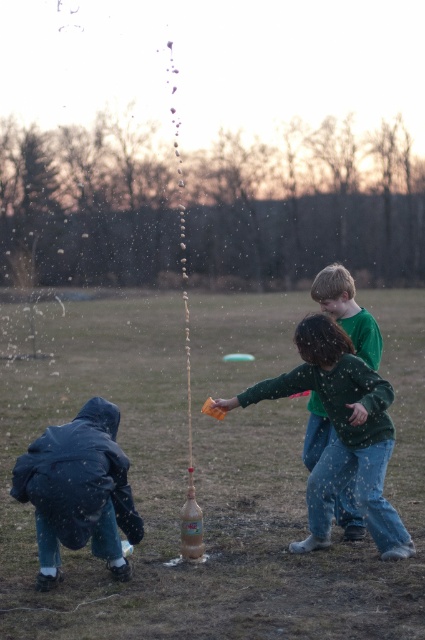
Question: Estimate the real-world distances between objects in this image. Which object is closer to the brown matte bottle at center?

Choices:
 (A) green cotton shirt at center
 (B) green matte shirt at center

Answer: (A)

Question: Is green cotton shirt at center further to the viewer compared to green matte shirt at center?

Choices:
 (A) no
 (B) yes

Answer: (A)

Question: Which of the following is the farthest from the observer?

Choices:
 (A) (238, 547)
 (B) (374, 328)

Answer: (A)

Question: Is brown matte bottle at center above green matte shirt at center?

Choices:
 (A) no
 (B) yes

Answer: (A)

Question: Which point is closer to the camera?

Choices:
 (A) green matte shirt at center
 (B) brown matte bottle at center
 (C) green cotton shirt at center

Answer: (B)

Question: Is green cotton shirt at center positioned before green matte shirt at center?

Choices:
 (A) yes
 (B) no

Answer: (A)